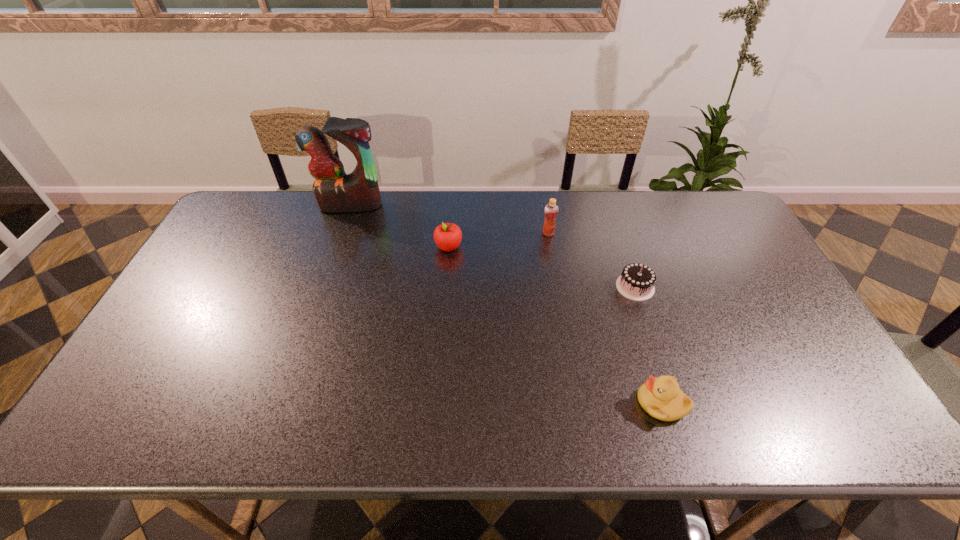
The width and height of the screenshot is (960, 540). What are the coordinates of `parrot` in the screenshot? It's located at (335, 191).

Find the location of `the tallest object`. the tallest object is located at coordinates (335, 191).

Image resolution: width=960 pixels, height=540 pixels. What are the coordinates of `the third object from right to left` in the screenshot? It's located at (551, 210).

Where is `the fourth nearest object`? The width and height of the screenshot is (960, 540). the fourth nearest object is located at coordinates (551, 210).

Where is `the fourth object from right to left`? the fourth object from right to left is located at coordinates tap(447, 236).

Locate an element on the screen. the third farthest object is located at coordinates (447, 236).

At what (x,y) coordinates should I click in order to perform the action: click on the nearest object. Please return your answer as a coordinate pair (x, y). Looking at the image, I should click on (661, 398).

Find the location of a particular element. the fourth farthest object is located at coordinates (636, 282).

I want to click on free space located 0.240m at the face of the leftmost object, so click(331, 264).

In order to click on vacant region located 0.050m on the back of the third object from left to right in this screenshot , I will do `click(546, 219)`.